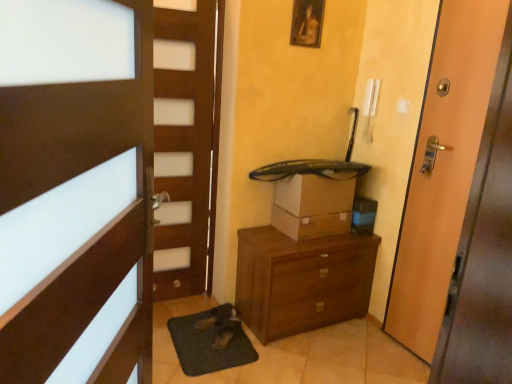
Question: Does wooden door at right, which is counted as the first door, starting from the back, have a lesser height compared to brown wooden chest of drawers at center?

Choices:
 (A) no
 (B) yes

Answer: (A)

Question: Can you see wooden door at right, which is counted as the second door, starting from the front, touching brown wooden chest of drawers at center?

Choices:
 (A) no
 (B) yes

Answer: (A)

Question: From the image's perspective, is wooden door at right, which is counted as the first door, starting from the back, on brown wooden chest of drawers at center?

Choices:
 (A) yes
 (B) no

Answer: (A)

Question: Can you confirm if wooden door at right, which is counted as the 2th door, starting from the left, is wider than brown wooden chest of drawers at center?

Choices:
 (A) no
 (B) yes

Answer: (A)

Question: Would you consider wooden door at right, which is counted as the first door, starting from the back, to be distant from brown wooden chest of drawers at center?

Choices:
 (A) no
 (B) yes

Answer: (A)

Question: Is wooden door at right, which is counted as the first door, starting from the back, not inside brown wooden chest of drawers at center?

Choices:
 (A) no
 (B) yes

Answer: (B)

Question: From a real-world perspective, is brown wooden chest of drawers at center positioned over green rubber bath mat at lower center based on gravity?

Choices:
 (A) no
 (B) yes

Answer: (B)

Question: Could you tell me if brown wooden chest of drawers at center is turned towards green rubber bath mat at lower center?

Choices:
 (A) no
 (B) yes

Answer: (A)

Question: Is brown wooden chest of drawers at center completely or partially outside of green rubber bath mat at lower center?

Choices:
 (A) no
 (B) yes

Answer: (B)

Question: Is brown wooden chest of drawers at center positioned before green rubber bath mat at lower center?

Choices:
 (A) no
 (B) yes

Answer: (A)

Question: Is brown wooden chest of drawers at center taller than green rubber bath mat at lower center?

Choices:
 (A) no
 (B) yes

Answer: (B)

Question: From the image's perspective, is brown wooden chest of drawers at center beneath green rubber bath mat at lower center?

Choices:
 (A) yes
 (B) no

Answer: (B)

Question: Can you confirm if green rubber bath mat at lower center is shorter than wooden door at right, which is counted as the 2th door, starting from the left?

Choices:
 (A) no
 (B) yes

Answer: (B)